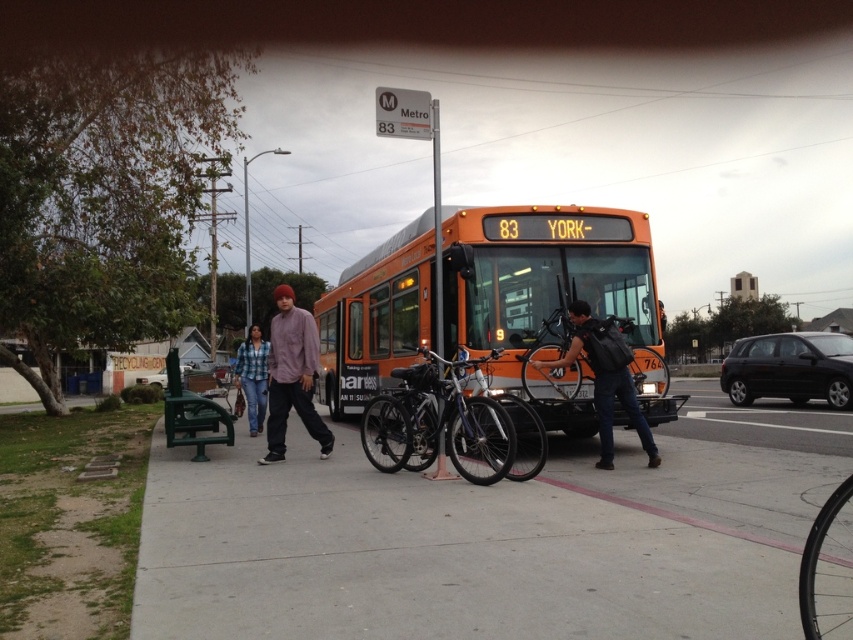
Does matte black backpack at center have a lesser width compared to green plastic bench at lower left?

Indeed, matte black backpack at center has a lesser width compared to green plastic bench at lower left.

Between point (654, 458) and point (192, 438), which one is positioned in front?

Point (654, 458) is in front.

Does point (601, 368) lie behind point (172, 381)?

No, (601, 368) is closer to viewer.

Find the location of a particular element. matte black backpack at center is located at coordinates (605, 378).

Who is more distant from viewer, (431,356) or (618,364)?

The point (618,364) is more distant.

Is shiny black bicycle at center below matte black backpack at center?

Indeed, shiny black bicycle at center is positioned under matte black backpack at center.

Is point (412, 420) more distant than point (640, 422)?

That is False.

Find the location of a particular element. This screenshot has height=640, width=853. shiny black bicycle at center is located at coordinates (438, 422).

Does point (279, 388) lie behind point (248, 348)?

No, (279, 388) is in front of (248, 348).

Does point (294, 332) come closer to viewer compared to point (253, 396)?

Yes, point (294, 332) is in front of point (253, 396).

Locate an element on the screen. The image size is (853, 640). matte purple shirt at center is located at coordinates (292, 376).